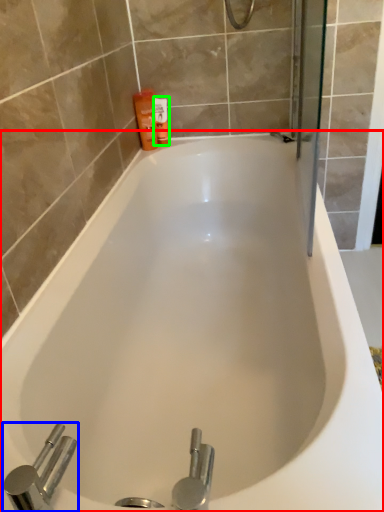
Question: Based on their relative distances, which object is nearer to bathtub (highlighted by a red box)? Choose from tap (highlighted by a blue box) and toiletry (highlighted by a green box).

Choices:
 (A) tap
 (B) toiletry

Answer: (A)